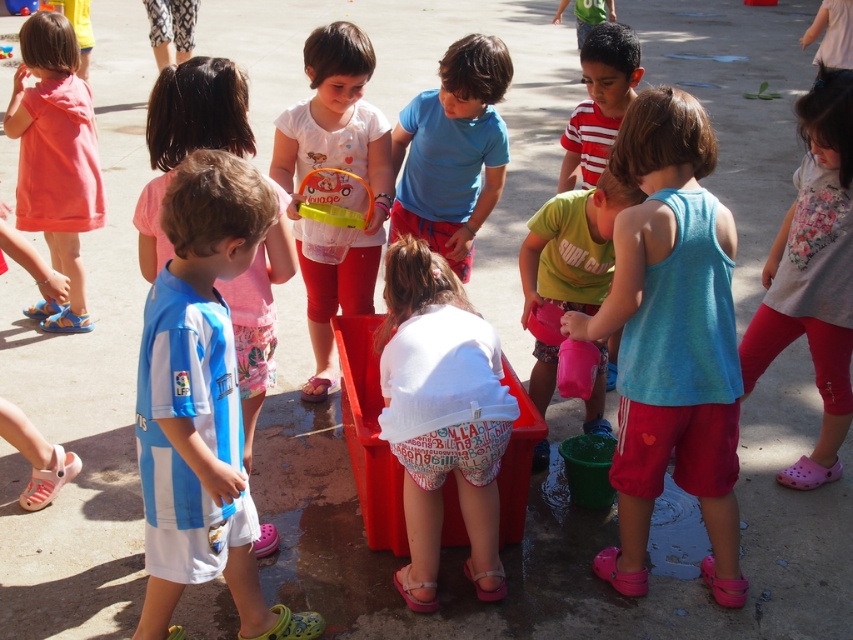
Is light blue tank top at center behind matte green shirt at center?

No, it is not.

Is light blue tank top at center bigger than matte green shirt at center?

Yes, light blue tank top at center is bigger than matte green shirt at center.

Find the location of a particular element. The image size is (853, 640). light blue tank top at center is located at coordinates (671, 339).

Which of these two, blue cotton shirt at center or matte green shirt at center, stands taller?

matte green shirt at center

Can you confirm if blue cotton shirt at center is positioned to the right of matte green shirt at center?

No, blue cotton shirt at center is not to the right of matte green shirt at center.

The height and width of the screenshot is (640, 853). Describe the element at coordinates (451, 150) in the screenshot. I see `blue cotton shirt at center` at that location.

Image resolution: width=853 pixels, height=640 pixels. I want to click on blue cotton shirt at center, so click(451, 150).

This screenshot has width=853, height=640. What do you see at coordinates (440, 417) in the screenshot?
I see `white cotton shirt at center` at bounding box center [440, 417].

From the picture: Between white cotton shirt at center and matte green shirt at center, which one has less height?

Standing shorter between the two is matte green shirt at center.

Describe the element at coordinates (440, 417) in the screenshot. I see `white cotton shirt at center` at that location.

Image resolution: width=853 pixels, height=640 pixels. Find the location of `white cotton shirt at center`. white cotton shirt at center is located at coordinates (440, 417).